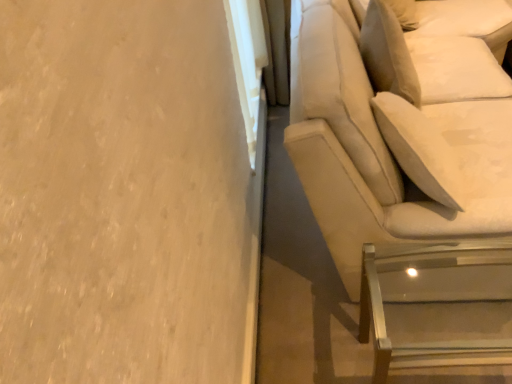
Measure the distance between point (408, 300) and camera.

A distance of 4.85 feet exists between point (408, 300) and camera.

Where is `clear glass table at lower right`? clear glass table at lower right is located at coordinates (436, 305).

Image resolution: width=512 pixels, height=384 pixels. What do you see at coordinates (436, 305) in the screenshot? I see `clear glass table at lower right` at bounding box center [436, 305].

Find the location of a particular element. beige fabric studio couch at right is located at coordinates (396, 135).

This screenshot has width=512, height=384. Describe the element at coordinates (396, 135) in the screenshot. I see `beige fabric studio couch at right` at that location.

Locate an element on the screen. clear glass table at lower right is located at coordinates (436, 305).

Is beige fabric studio couch at right to the right of clear glass table at lower right from the viewer's perspective?

Indeed, beige fabric studio couch at right is positioned on the right side of clear glass table at lower right.

Who is more distant, beige fabric studio couch at right or clear glass table at lower right?

Positioned behind is clear glass table at lower right.

Does point (459, 156) come farther from viewer compared to point (369, 320)?

Yes, it is.

From the image's perspective, which is below, beige fabric studio couch at right or clear glass table at lower right?

From the image's view, clear glass table at lower right is below.

From the picture: From a real-world perspective, who is located lower, beige fabric studio couch at right or clear glass table at lower right?

From a 3D spatial view, clear glass table at lower right is below.

Looking at this image, is beige fabric studio couch at right wider or thinner than clear glass table at lower right?

beige fabric studio couch at right is wider than clear glass table at lower right.

Does beige fabric studio couch at right have a lesser height compared to clear glass table at lower right?

In fact, beige fabric studio couch at right may be taller than clear glass table at lower right.

From the picture: Who is smaller, beige fabric studio couch at right or clear glass table at lower right?

Smaller between the two is clear glass table at lower right.

Choose the correct answer: Is beige fabric studio couch at right inside clear glass table at lower right or outside it?

beige fabric studio couch at right is outside clear glass table at lower right.

Would you say beige fabric studio couch at right is a long distance from clear glass table at lower right?

Actually, beige fabric studio couch at right and clear glass table at lower right are a little close together.

Does beige fabric studio couch at right turn towards clear glass table at lower right?

No, beige fabric studio couch at right is not turned towards clear glass table at lower right.

How different are the orientations of beige fabric studio couch at right and clear glass table at lower right in degrees?

The angular difference between beige fabric studio couch at right and clear glass table at lower right is 0.457 degrees.

How much distance is there between beige fabric studio couch at right and clear glass table at lower right?

They are 15.54 inches apart.

This screenshot has height=384, width=512. In order to click on furniture located below the beige fabric studio couch at right (from the image's perspective) in this screenshot , I will do `click(436, 305)`.

Considering the positions of objects clear glass table at lower right and beige fabric studio couch at right in the image provided, who is more to the right, clear glass table at lower right or beige fabric studio couch at right?

From the viewer's perspective, beige fabric studio couch at right appears more on the right side.

Considering the positions of objects clear glass table at lower right and beige fabric studio couch at right in the image provided, who is behind, clear glass table at lower right or beige fabric studio couch at right?

clear glass table at lower right.

Is point (511, 261) more distant than point (315, 67)?

Yes, it is.

From the image's perspective, is clear glass table at lower right located above beige fabric studio couch at right?

No, from the image's perspective, clear glass table at lower right is not above beige fabric studio couch at right.

From a real-world perspective, which is physically above, clear glass table at lower right or beige fabric studio couch at right?

beige fabric studio couch at right.

Considering the sizes of objects clear glass table at lower right and beige fabric studio couch at right in the image provided, who is thinner, clear glass table at lower right or beige fabric studio couch at right?

clear glass table at lower right is thinner.

Can you confirm if clear glass table at lower right is taller than beige fabric studio couch at right?

No, clear glass table at lower right is not taller than beige fabric studio couch at right.

Considering the relative sizes of clear glass table at lower right and beige fabric studio couch at right in the image provided, is clear glass table at lower right smaller than beige fabric studio couch at right?

Yes, clear glass table at lower right is smaller than beige fabric studio couch at right.

Would you say clear glass table at lower right is outside beige fabric studio couch at right?

That's correct, clear glass table at lower right is outside of beige fabric studio couch at right.

Is clear glass table at lower right in contact with beige fabric studio couch at right?

No, clear glass table at lower right is not in contact with beige fabric studio couch at right.

Is clear glass table at lower right positioned with its back to beige fabric studio couch at right?

No, clear glass table at lower right is not facing away from beige fabric studio couch at right.

I want to click on furniture that is under the beige fabric studio couch at right (from a real-world perspective), so click(x=436, y=305).

Identify the location of studio couch above the clear glass table at lower right (from the image's perspective). (396, 135).

Identify the location of furniture lying below the beige fabric studio couch at right (from the image's perspective). (436, 305).